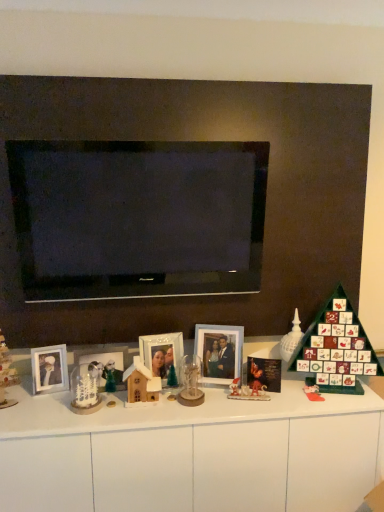
Where is `vacant area located to the right-hand side of clear glass candle holder at center, which is the 1th candle holder in right-to-left order`? The image size is (384, 512). vacant area located to the right-hand side of clear glass candle holder at center, which is the 1th candle holder in right-to-left order is located at coordinates (223, 398).